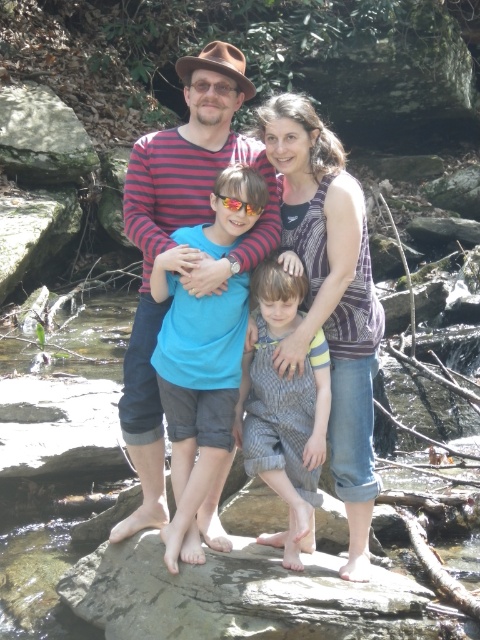
You are taking a photo of the family and notice two points in the image at coordinates point (144, 524) and point (142, 604). Which point is closer to the camera?

Point (144, 524) is further to the camera than point (142, 604), so the closer point to the camera is point (142, 604).

You are a hiker who wants to sit on the gray rough rock at center. You are wearing the gray striped overalls at center. Can you sit comfortably on the rock without your overalls getting dirty?

The gray rough rock at center is shorter than the gray striped overalls at center, so the rock is not tall enough to reach the overalls. Therefore, sitting on the rock would not dirty the overalls.